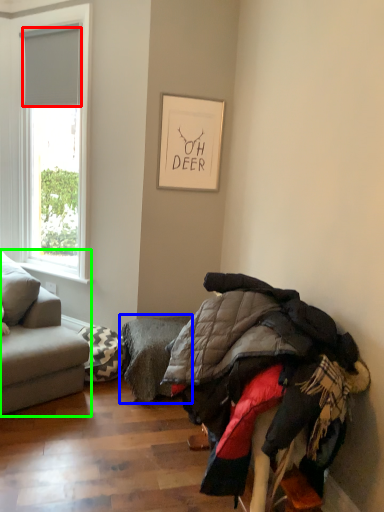
Question: Considering the real-world distances, which object is closest to blind (highlighted by a red box)? footrest (highlighted by a blue box) or studio couch (highlighted by a green box).

Choices:
 (A) footrest
 (B) studio couch

Answer: (B)